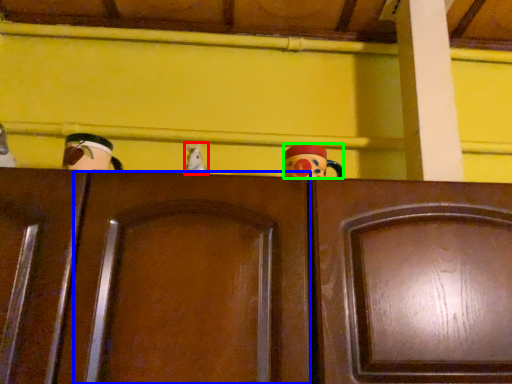
Question: Which object is positioned closest to toy (highlighted by a red box)? Select from door (highlighted by a blue box) and toy (highlighted by a green box).

Choices:
 (A) door
 (B) toy

Answer: (B)